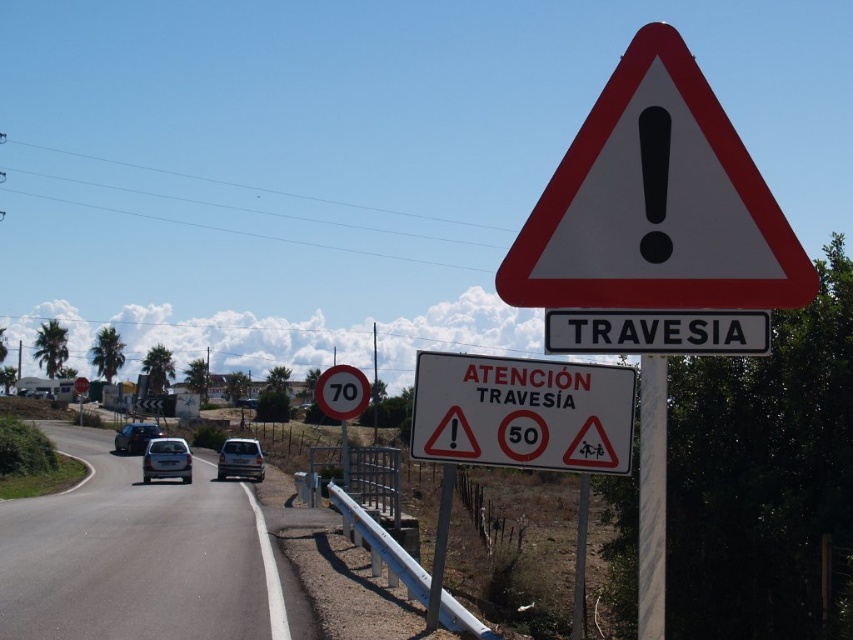
Question: Which point is closer to the camera?

Choices:
 (A) (648, 588)
 (B) (579, 529)

Answer: (A)

Question: Which point is closer to the camera taking this photo?

Choices:
 (A) (575, 584)
 (B) (152, 429)
 (C) (236, 472)

Answer: (A)

Question: Is silver metallic car at center above satin silver car at center?

Choices:
 (A) yes
 (B) no

Answer: (A)

Question: From the image, what is the correct spatial relationship of white plastic sign at center in relation to satin black car at center?

Choices:
 (A) above
 (B) below

Answer: (A)

Question: Is white reflective triangle at upper center bigger than white plastic sign at upper center?

Choices:
 (A) no
 (B) yes

Answer: (B)

Question: Considering the real-world distances, which object is closest to the silver metallic car at center?

Choices:
 (A) satin silver car at center
 (B) white plastic sign at center
 (C) white plastic sign at upper center

Answer: (A)